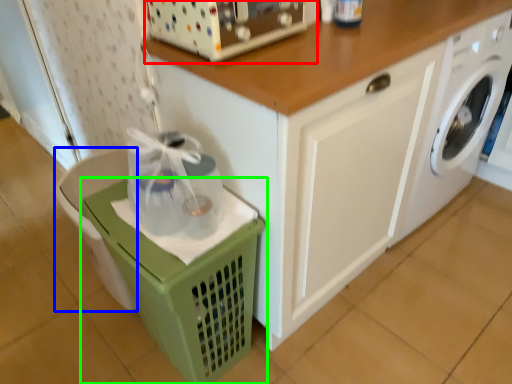
Question: Which is nearer to the appliance (highlighted by a red box)? dish washer (highlighted by a blue box) or basket (highlighted by a green box).

Choices:
 (A) dish washer
 (B) basket

Answer: (B)